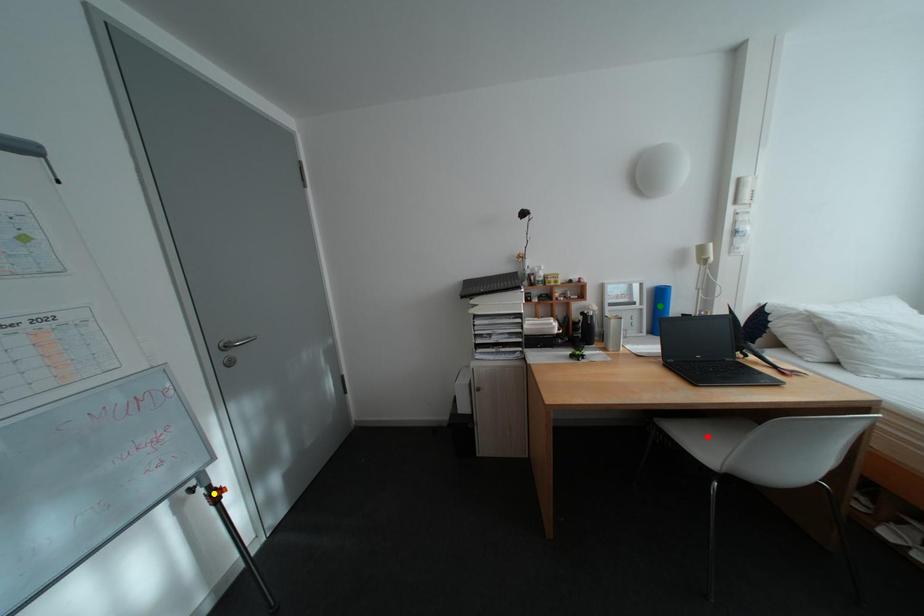
Consider the image. Order these from nearest to farthest:
- red point
- green point
- yellow point

green point
red point
yellow point